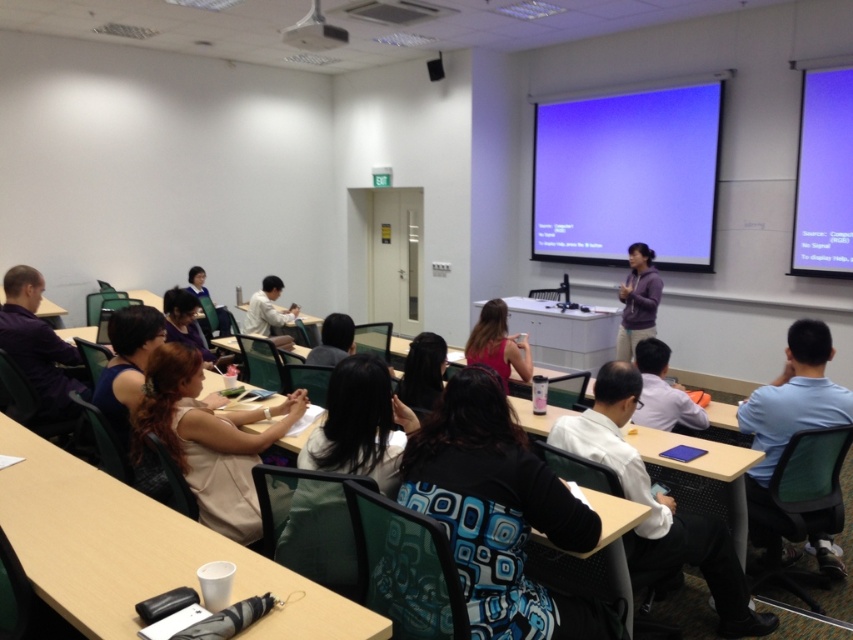
What do you see at coordinates (357, 426) in the screenshot? The width and height of the screenshot is (853, 640). I see `white fabric shirt at center` at bounding box center [357, 426].

Locate an element on the screen. This screenshot has width=853, height=640. white fabric shirt at center is located at coordinates (357, 426).

Find the location of a particular element. white fabric shirt at center is located at coordinates (357, 426).

Is white fabric shirt at center below matte pink shirt at center?

Yes, white fabric shirt at center is below matte pink shirt at center.

Does white fabric shirt at center have a greater height compared to matte pink shirt at center?

Yes.

You are a GUI agent. You are given a task and a screenshot of the screen. Output one action in this format:
    pyautogui.click(x=<x>, y=<y>)
    Task: Click on the white fabric shirt at center
    This screenshot has width=853, height=640.
    Given the screenshot: What is the action you would take?
    [x=357, y=426]

Image resolution: width=853 pixels, height=640 pixels. I want to click on white fabric shirt at center, so click(357, 426).

From the picture: Is white glossy table at center smaller than matte black table at left?

Actually, white glossy table at center might be larger than matte black table at left.

Between point (601, 349) and point (61, 312), which one is positioned behind?

Point (601, 349)

I want to click on white glossy table at center, so click(566, 332).